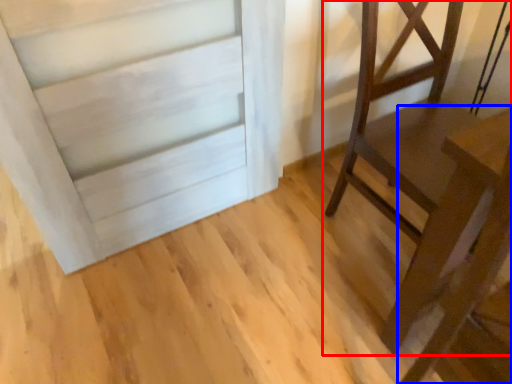
Question: Which object appears farthest to the camera in this image, furniture (highlighted by a red box) or table (highlighted by a blue box)?

Choices:
 (A) furniture
 (B) table

Answer: (A)